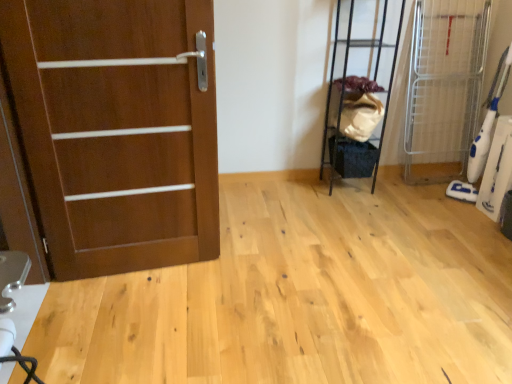
The image size is (512, 384). In order to click on vacant space in front of black metal shelf at upper right, which ranks as the second elevator in right-to-left order in this screenshot , I will do `click(358, 209)`.